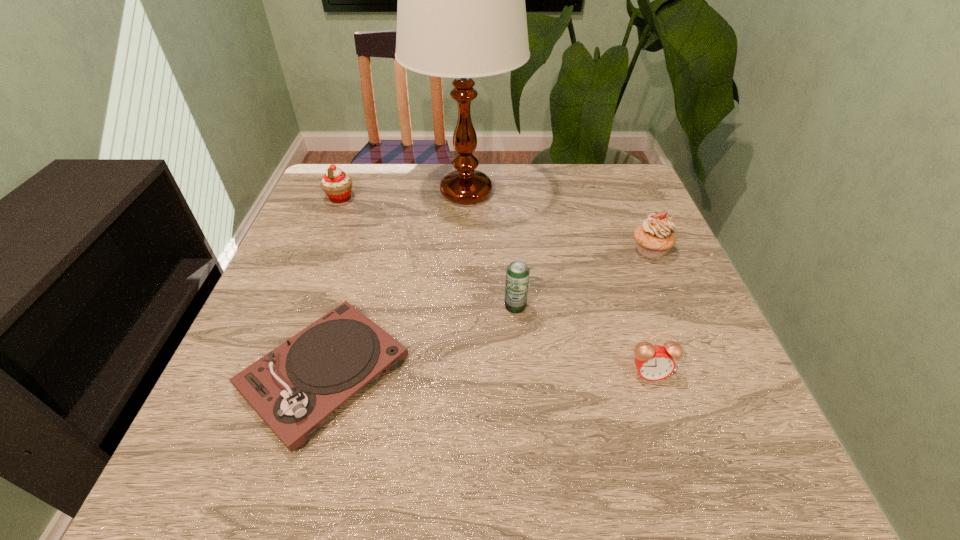
Locate an element on the screen. vacant space that is in between the farther cupcake and the rightmost object is located at coordinates (495, 224).

This screenshot has height=540, width=960. What are the coordinates of `unoccupied position between the tallest object and the farther cupcake` in the screenshot? It's located at (403, 195).

What are the coordinates of `unoccupied position between the farther cupcake and the shortest object` in the screenshot? It's located at (332, 286).

Where is `vacant area that lies between the beer can and the farther cupcake`? This screenshot has height=540, width=960. vacant area that lies between the beer can and the farther cupcake is located at coordinates (428, 252).

Identify the location of free point between the beer can and the farther cupcake. This screenshot has height=540, width=960. (428, 252).

The image size is (960, 540). I want to click on vacant point located between the nearer cupcake and the beer can, so point(583,278).

Where is `free area in between the shortest object and the nearer cupcake`? free area in between the shortest object and the nearer cupcake is located at coordinates (488, 312).

Find the location of a particular element. The image size is (960, 540). vacant space that's between the right cupcake and the farther cupcake is located at coordinates (495, 224).

Point out which object is positioned as the nearest to the phonograph_record. Please provide its 2D coordinates. Your answer should be formatted as a tuple, i.e. [(x, y)], where the tuple contains the x and y coordinates of a point satisfying the conditions above.

[(517, 273)]

The image size is (960, 540). What are the coordinates of `object that is the closest to the alarm clock` in the screenshot? It's located at (517, 273).